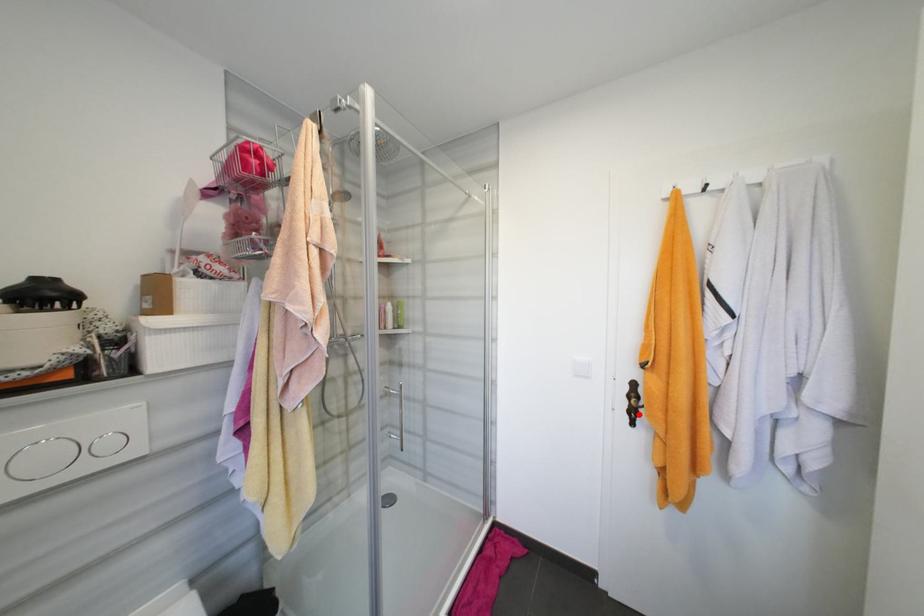
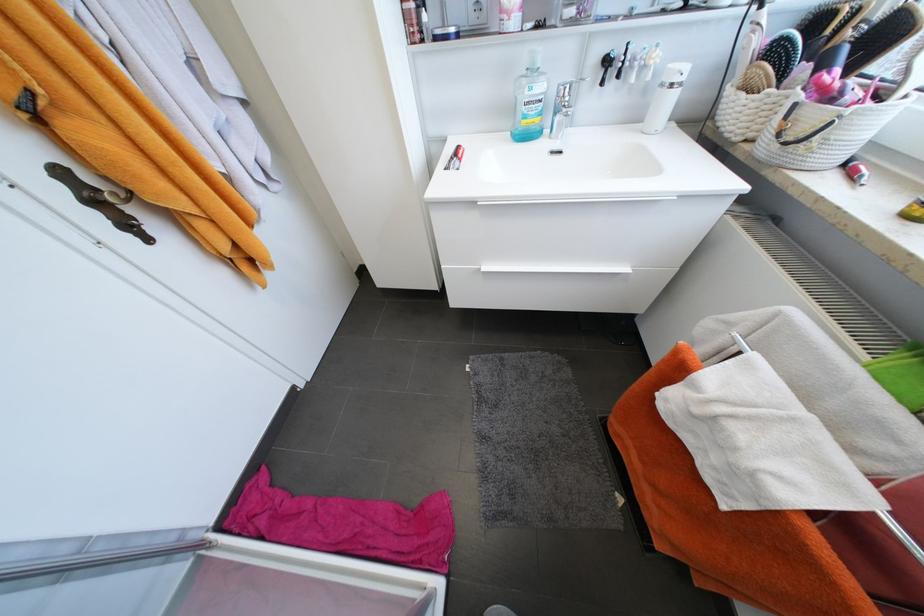
Where in the second image is the point corresponding to the highlighted location from the first image?

(132, 225)